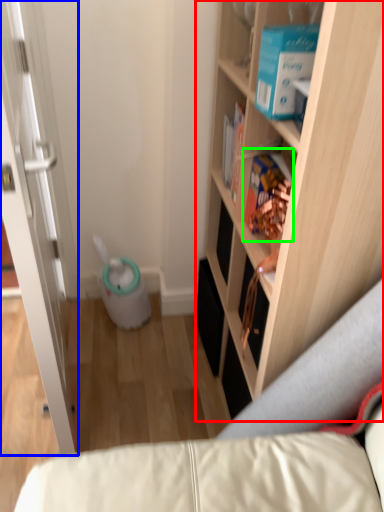
Question: Which object is positioned farthest from cabinetry (highlighted by a red box)? Select from door (highlighted by a blue box) and book (highlighted by a green box).

Choices:
 (A) door
 (B) book

Answer: (A)